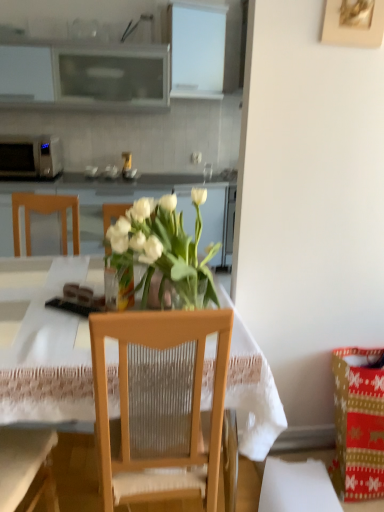
Question: From the image's perspective, would you say matte glass coffee cup at center is shown under clear glass vase at center?

Choices:
 (A) yes
 (B) no

Answer: (B)

Question: Can you confirm if matte glass coffee cup at center is shorter than clear glass vase at center?

Choices:
 (A) yes
 (B) no

Answer: (A)

Question: Considering the relative positions of matte glass coffee cup at center and clear glass vase at center in the image provided, is matte glass coffee cup at center to the right of clear glass vase at center from the viewer's perspective?

Choices:
 (A) no
 (B) yes

Answer: (B)

Question: From a real-world perspective, is matte glass coffee cup at center located beneath clear glass vase at center?

Choices:
 (A) yes
 (B) no

Answer: (B)

Question: Is the position of matte glass coffee cup at center more distant than that of clear glass vase at center?

Choices:
 (A) no
 (B) yes

Answer: (B)

Question: From the image's perspective, is clear glass vase at center positioned above or below wooden picture frame at upper right?

Choices:
 (A) above
 (B) below

Answer: (B)

Question: In terms of size, does clear glass vase at center appear bigger or smaller than wooden picture frame at upper right?

Choices:
 (A) big
 (B) small

Answer: (B)

Question: Is clear glass vase at center inside the boundaries of wooden picture frame at upper right, or outside?

Choices:
 (A) inside
 (B) outside

Answer: (B)

Question: In terms of width, does clear glass vase at center look wider or thinner when compared to wooden picture frame at upper right?

Choices:
 (A) thin
 (B) wide

Answer: (B)

Question: Is transparent glass vase at center in front of or behind matte glass coffee cup at center in the image?

Choices:
 (A) front
 (B) behind

Answer: (A)

Question: Is point (29, 389) closer or farther from the camera than point (210, 163)?

Choices:
 (A) closer
 (B) farther

Answer: (A)

Question: From the image's perspective, is transparent glass vase at center above or below matte glass coffee cup at center?

Choices:
 (A) below
 (B) above

Answer: (A)

Question: Visually, is transparent glass vase at center positioned to the left or to the right of matte glass coffee cup at center?

Choices:
 (A) right
 (B) left

Answer: (B)

Question: Relative to wooden chair at center, is matte glass coffee cup at center in front or behind?

Choices:
 (A) behind
 (B) front

Answer: (A)

Question: From the image's perspective, is matte glass coffee cup at center above or below wooden chair at center?

Choices:
 (A) below
 (B) above

Answer: (B)